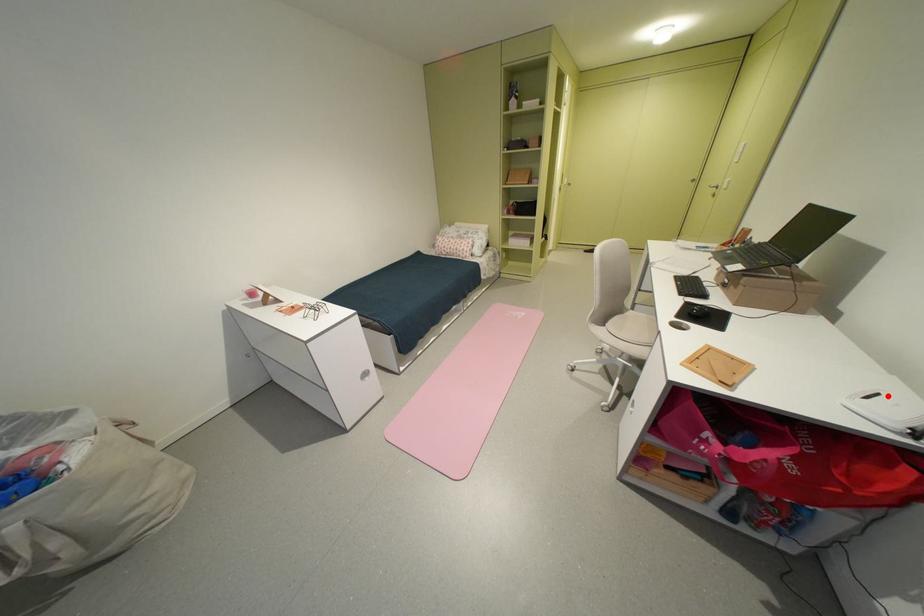
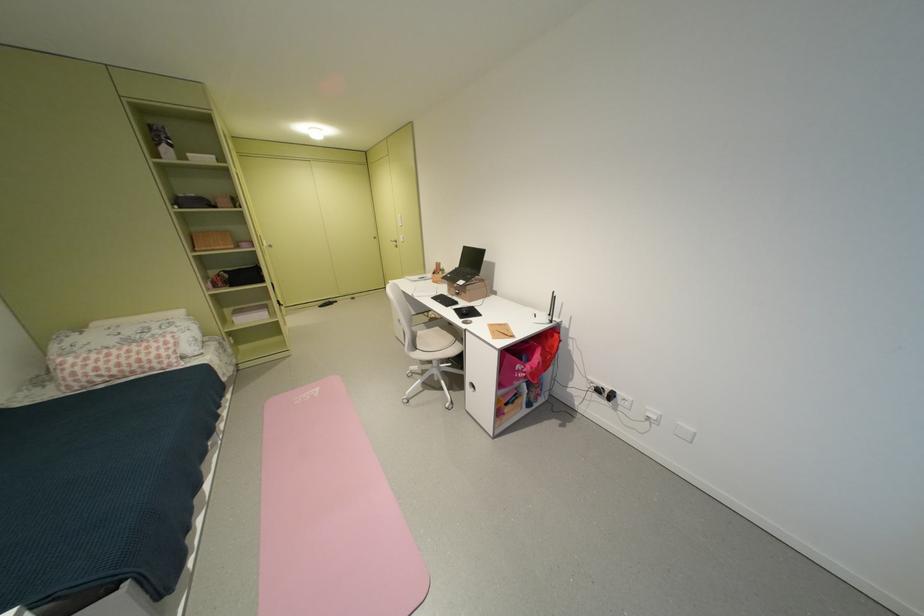
Question: I am providing you with two images of the same scene from different viewpoints. A red point is marked on the first image. At the location where the point appears in image 1, is it still visible in image 2?

Choices:
 (A) Yes
 (B) No

Answer: (A)